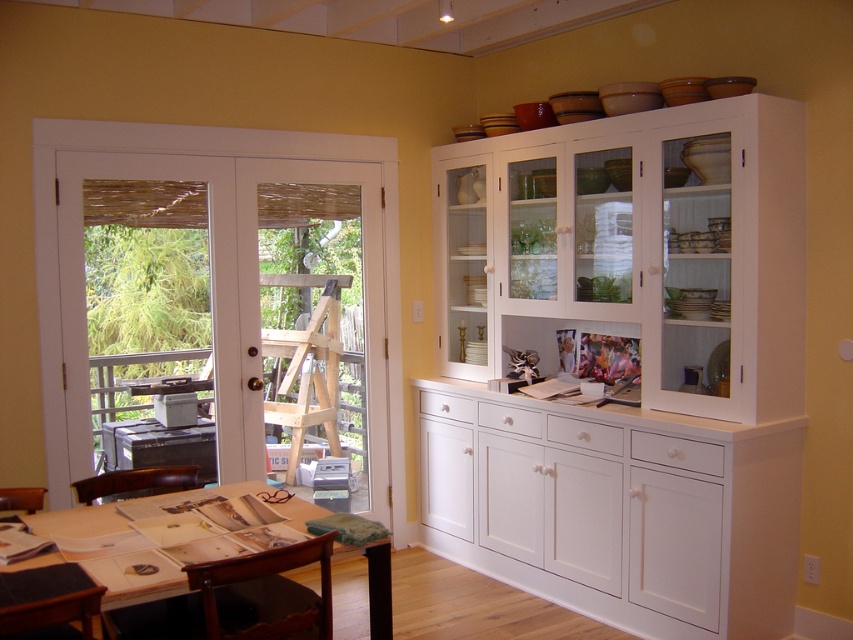
You are a delivery person trying to bring a large package through the white glass door at left. The wooden table at lower left is blocking the doorway. Can you fit the package through the doorway without moving the table?

The white glass door at left has a lesser width compared to wooden table at lower left. Since the door is narrower than the table, the package cannot fit through the doorway without moving the table.

You are setting up a small potted plant on the wooden table at lower left. Will the white glass door at left block sunlight from reaching the plant?

The white glass door at left is positioned over the wooden table at lower left, so it may cast a shadow on the table, potentially blocking some sunlight from reaching the plant.

You are standing in the dining area and want to take a photo of both the French doors and the white built in cabinet. You notice two points marked in the image, one at coordinate point (131, 186) and another at point (131, 595). Which point should you focus on first to ensure both objects are in focus?

You should focus on point (131, 186) first because it is closer to the camera compared to point (131, 595). This ensures that both the French doors and the white built in cabinet are in focus.